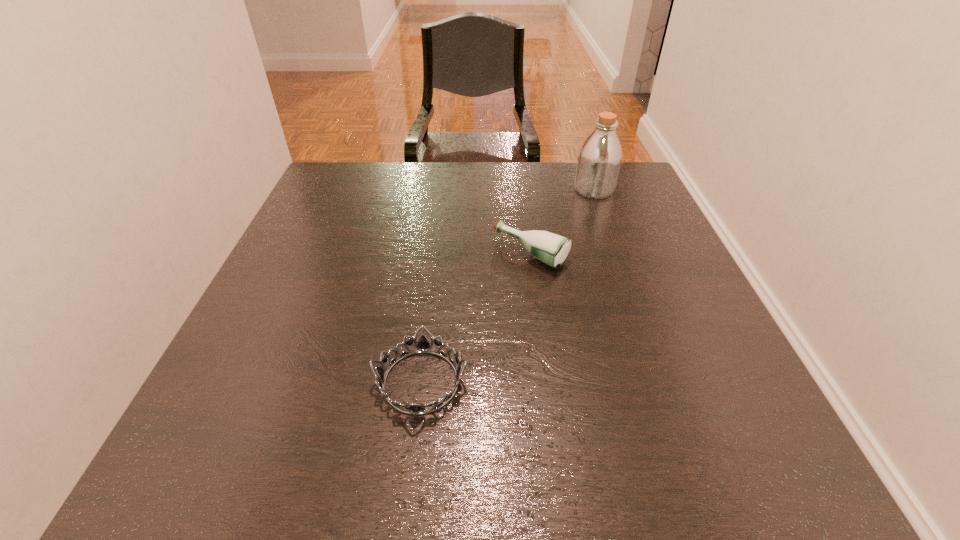
Identify the location of object positioned at the far right corner. (599, 159).

In the image, there is a desktop. At what (x,y) coordinates should I click in order to perform the action: click on vacant space at the far edge. Please return your answer as a coordinate pair (x, y). The height and width of the screenshot is (540, 960). Looking at the image, I should click on (443, 186).

The height and width of the screenshot is (540, 960). I want to click on vacant region at the near edge of the desktop, so click(x=633, y=457).

At what (x,y) coordinates should I click in order to perform the action: click on free space at the left edge of the desktop. Please return your answer as a coordinate pair (x, y). Looking at the image, I should click on (332, 292).

Locate an element on the screen. vacant space at the right edge of the desktop is located at coordinates (608, 249).

Identify the location of free spot at the far right corner of the desktop. (626, 179).

The image size is (960, 540). In order to click on vacant region between the farther bottle and the leftmost object in this screenshot , I will do `click(507, 286)`.

Identify the location of vacant area that lies between the left bottle and the shortest object. The image size is (960, 540). (476, 318).

What are the coordinates of `free area in between the second nearest object and the farther bottle` in the screenshot? It's located at (563, 222).

You are a GUI agent. You are given a task and a screenshot of the screen. Output one action in this format:
    pyautogui.click(x=<x>, y=<y>)
    Task: Click on the vacant space in between the second object from right to left and the leftmost object
    The image size is (960, 540).
    Given the screenshot: What is the action you would take?
    pyautogui.click(x=476, y=318)